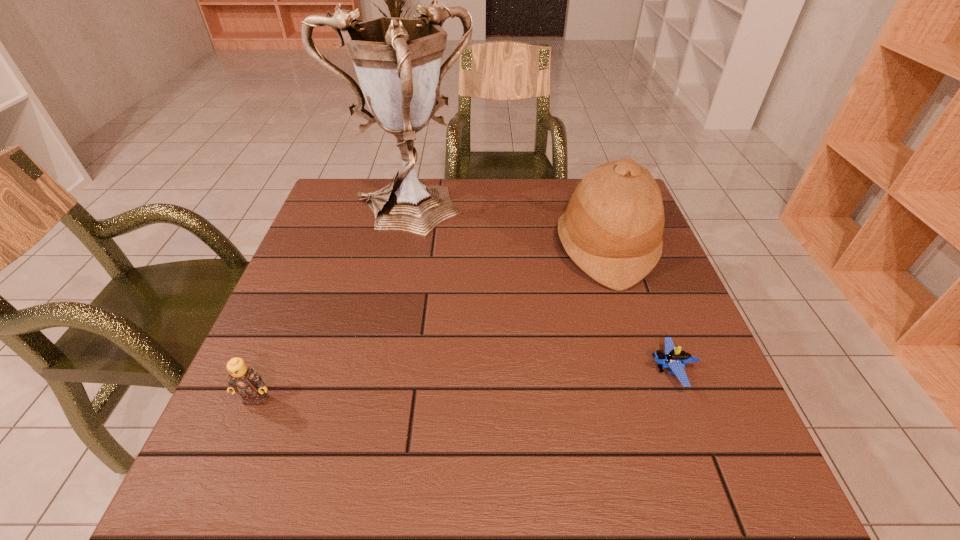
Locate an element on the screen. This screenshot has height=540, width=960. the tallest object is located at coordinates (397, 60).

Where is `the third shortest object`? Image resolution: width=960 pixels, height=540 pixels. the third shortest object is located at coordinates (612, 229).

At what (x,y) coordinates should I click in order to perform the action: click on the taller Lego. Please return your answer as a coordinate pair (x, y). Looking at the image, I should click on (244, 380).

At what (x,y) coordinates should I click in order to perform the action: click on the second shortest object. Please return your answer as a coordinate pair (x, y). This screenshot has height=540, width=960. Looking at the image, I should click on (244, 380).

Locate an element on the screen. This screenshot has width=960, height=540. the right Lego is located at coordinates (674, 358).

Where is `the shorter Lego`? Image resolution: width=960 pixels, height=540 pixels. the shorter Lego is located at coordinates (674, 358).

The width and height of the screenshot is (960, 540). I want to click on free space located on the right of the tallest object, so click(x=573, y=215).

Locate an element on the screen. vacant point located 0.210m on the front-facing side of the hat is located at coordinates (474, 248).

The width and height of the screenshot is (960, 540). Identify the location of vacant area located on the front-facing side of the hat. (467, 248).

At what (x,y) coordinates should I click in order to perform the action: click on free space located on the front-facing side of the hat. Please return your answer as a coordinate pair (x, y). Image resolution: width=960 pixels, height=540 pixels. Looking at the image, I should click on click(420, 248).